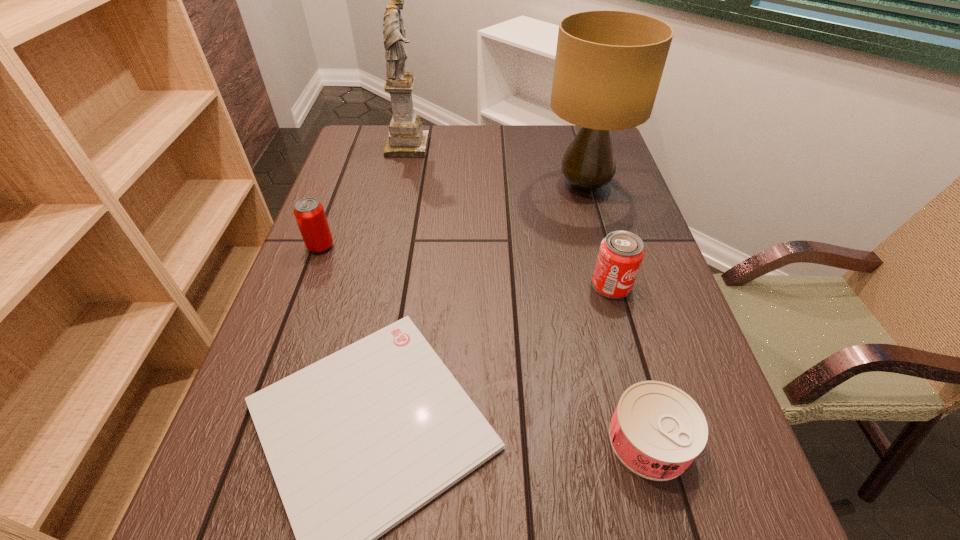
What are the coordinates of `free spot located 0.240m on the back of the leftmost can` in the screenshot? It's located at coord(345,182).

This screenshot has height=540, width=960. What are the coordinates of `free space located 0.310m on the back of the shortest can` in the screenshot? It's located at (605, 276).

You are a GUI agent. You are given a task and a screenshot of the screen. Output one action in this format:
    pyautogui.click(x=<x>, y=<y>)
    Task: Click on the sculpture present at the far edge
    The image size is (960, 540).
    Given the screenshot: What is the action you would take?
    pyautogui.click(x=406, y=138)

This screenshot has height=540, width=960. Find the location of `lampshade located at the far edge`. lampshade located at the far edge is located at coordinates (608, 66).

The height and width of the screenshot is (540, 960). I want to click on sculpture that is at the left edge, so click(x=406, y=138).

Locate an element on the screen. This screenshot has height=540, width=960. can present at the left edge is located at coordinates (309, 213).

The width and height of the screenshot is (960, 540). I want to click on lampshade that is at the right edge, so click(x=608, y=66).

I want to click on object that is at the far left corner, so click(x=406, y=138).

Locate an element on the screen. This screenshot has width=960, height=540. object that is at the far right corner is located at coordinates click(x=608, y=66).

Locate an element on the screen. vacant space at the far edge of the desktop is located at coordinates (506, 137).